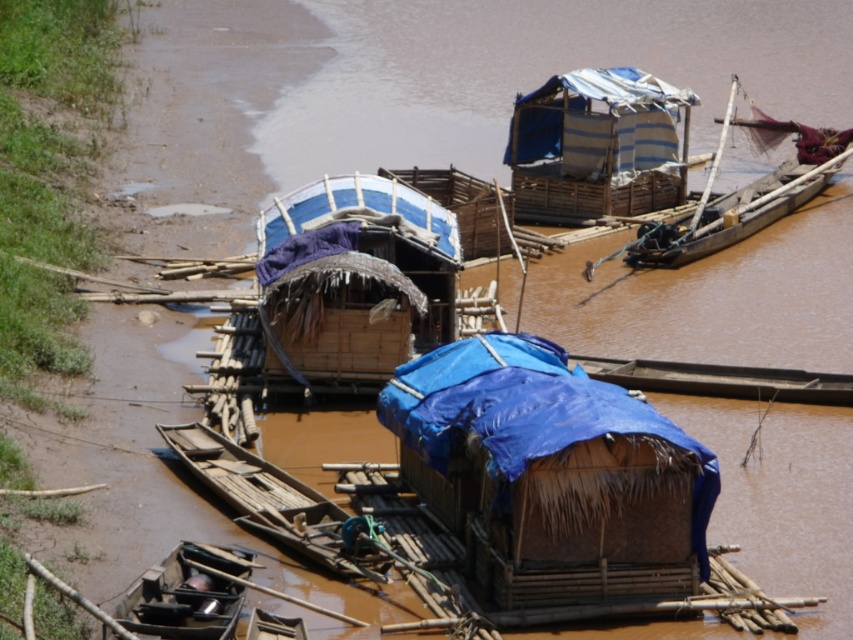
Question: Observing the image, what is the correct spatial positioning of wooden boat at center in reference to wooden boat at right?

Choices:
 (A) below
 (B) above

Answer: (A)

Question: Which object is the farthest from the blue tarpaulin boat at center?

Choices:
 (A) blue tarpaulin hut at center
 (B) black matte boat at lower left
 (C) wooden boat at center

Answer: (B)

Question: Among these points, which one is nearest to the camera?

Choices:
 (A) (403, 372)
 (B) (648, 257)
 (C) (279, 472)
 (D) (590, 177)

Answer: (A)

Question: Which object appears closest to the camera in this image?

Choices:
 (A) black matte boat at lower left
 (B) wooden boat at right
 (C) wooden boat at center
 (D) blue tarpaulin hut at center

Answer: (A)

Question: Does wooden boat at center lie behind wooden boat at right?

Choices:
 (A) no
 (B) yes

Answer: (A)

Question: Can you confirm if wooden boat at center is positioned to the left of black matte boat at lower left?

Choices:
 (A) yes
 (B) no

Answer: (B)